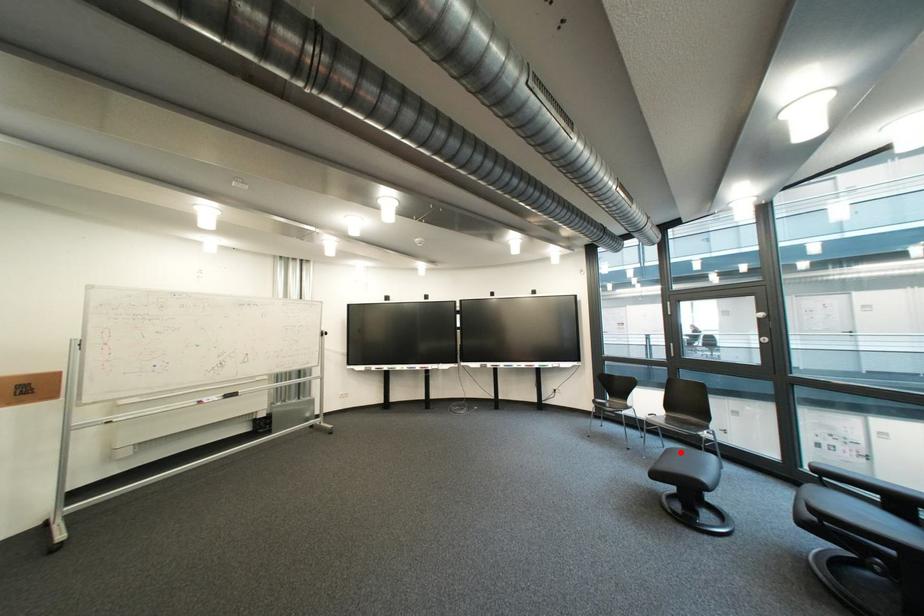
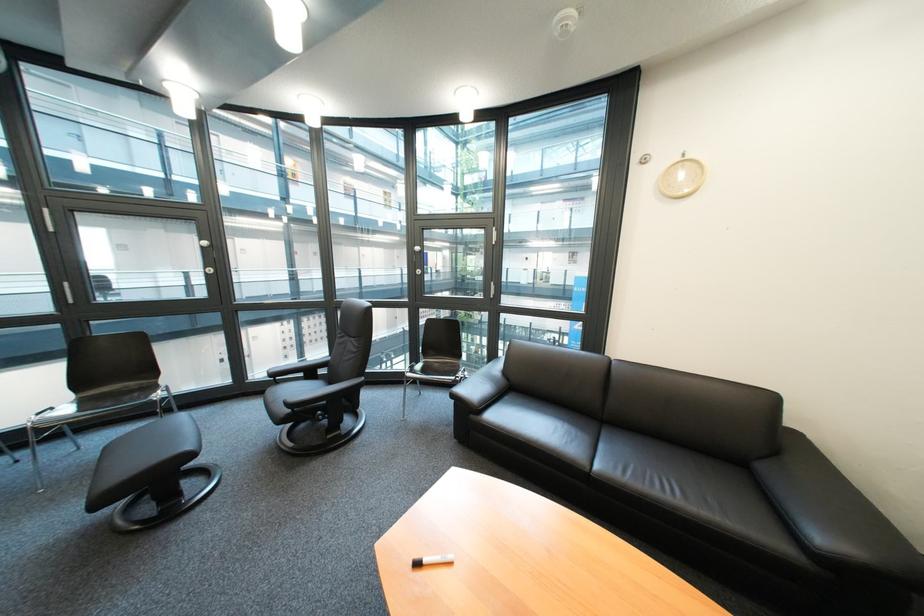
The point at the highlighted location is marked in the first image. Where is the corresponding point in the second image?

(119, 450)